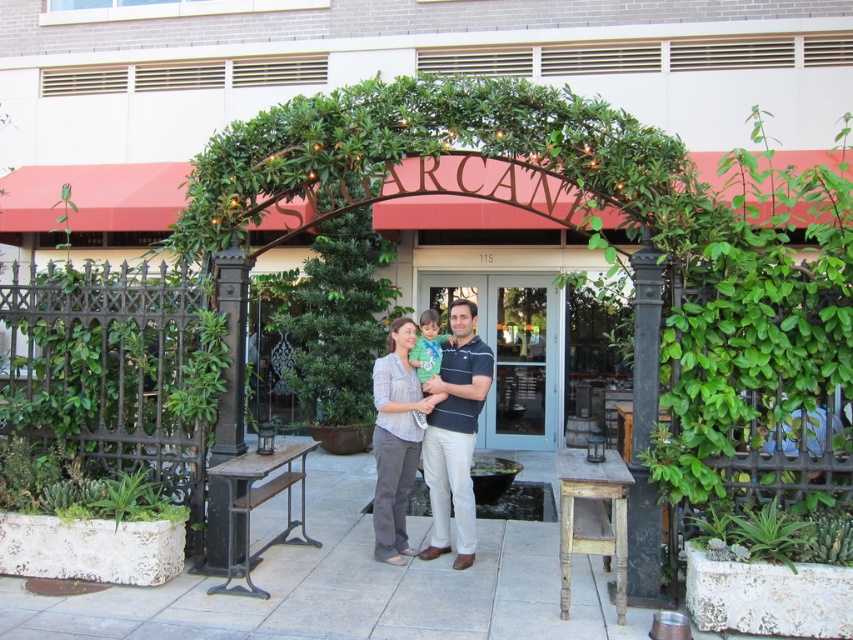
Question: Does matte striped shirt at center have a greater width compared to wooden rustic stool at center?

Choices:
 (A) yes
 (B) no

Answer: (A)

Question: Estimate the real-world distances between objects in this image. Which object is farther from the wooden rustic stool at center?

Choices:
 (A) matte green shirt at center
 (B) matte striped shirt at center
 (C) green succulent at lower right

Answer: (A)

Question: Among these objects, which one is farthest from the camera?

Choices:
 (A) green succulent at lower right
 (B) matte green shirt at center
 (C) matte striped shirt at center
 (D) wooden rustic stool at center

Answer: (B)

Question: Is matte striped shirt at center positioned at the back of matte green shirt at center?

Choices:
 (A) no
 (B) yes

Answer: (A)

Question: Observing the image, what is the correct spatial positioning of green succulent at lower right in reference to matte green shirt at center?

Choices:
 (A) right
 (B) left

Answer: (A)

Question: Among these objects, which one is nearest to the camera?

Choices:
 (A) green succulent at lower right
 (B) matte striped shirt at center
 (C) wooden rustic stool at center

Answer: (A)